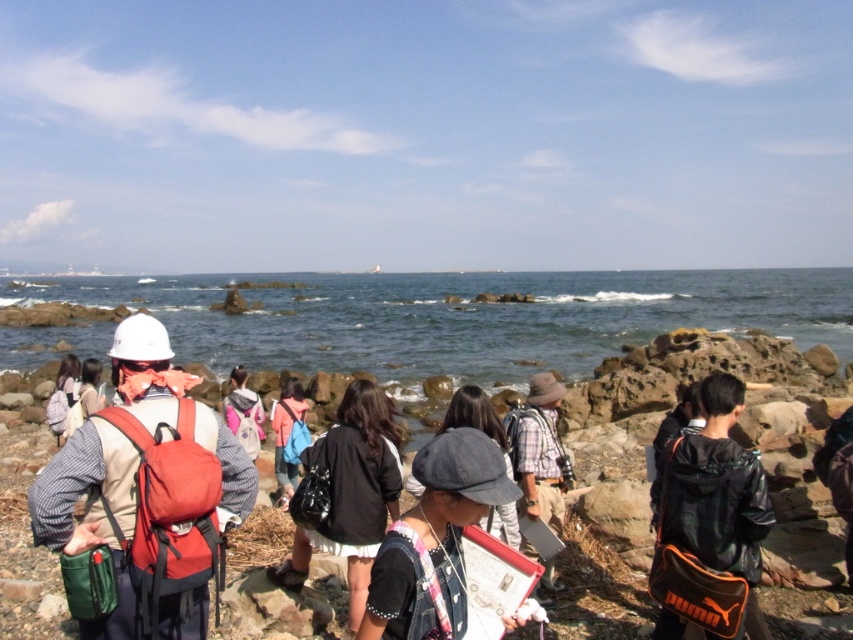
Can you confirm if clear blue water at center is smaller than leather jacket at center?

No.

Which is below, clear blue water at center or leather jacket at center?

leather jacket at center

Between point (679, 284) and point (682, 577), which one is positioned in front?

Positioned in front is point (682, 577).

At what (x,y) coordinates should I click in order to perform the action: click on clear blue water at center. Please return your answer as a coordinate pair (x, y). Image resolution: width=853 pixels, height=640 pixels. Looking at the image, I should click on (465, 317).

Who is more distant from viewer, (167, 634) or (756, 570)?

The point (756, 570) is more distant.

Identify the location of matte white helmet at left. (146, 492).

Does point (74, 465) come farther from viewer compared to point (682, 563)?

No, (74, 465) is closer to viewer.

Identify the location of matte white helmet at left. (146, 492).

Which of these two, matte white helmet at left or denim hat at center, stands shorter?

denim hat at center

Between matte white helmet at left and denim hat at center, which one is positioned lower?

denim hat at center

Does point (219, 483) lie in front of point (426, 625)?

That is False.

At what (x,y) coordinates should I click in order to perform the action: click on matte white helmet at left. Please return your answer as a coordinate pair (x, y). This screenshot has width=853, height=640. Looking at the image, I should click on (146, 492).